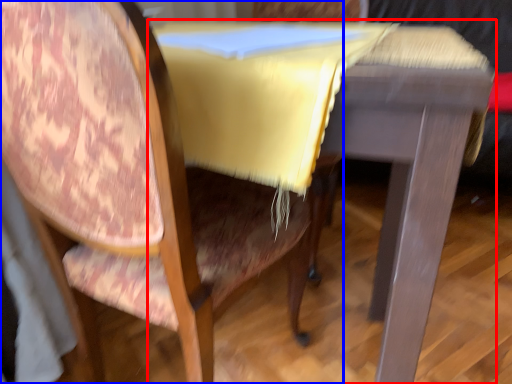
Question: Which of the following is the closest to the observer, table (highlighted by a red box) or chair (highlighted by a blue box)?

Choices:
 (A) table
 (B) chair

Answer: (B)